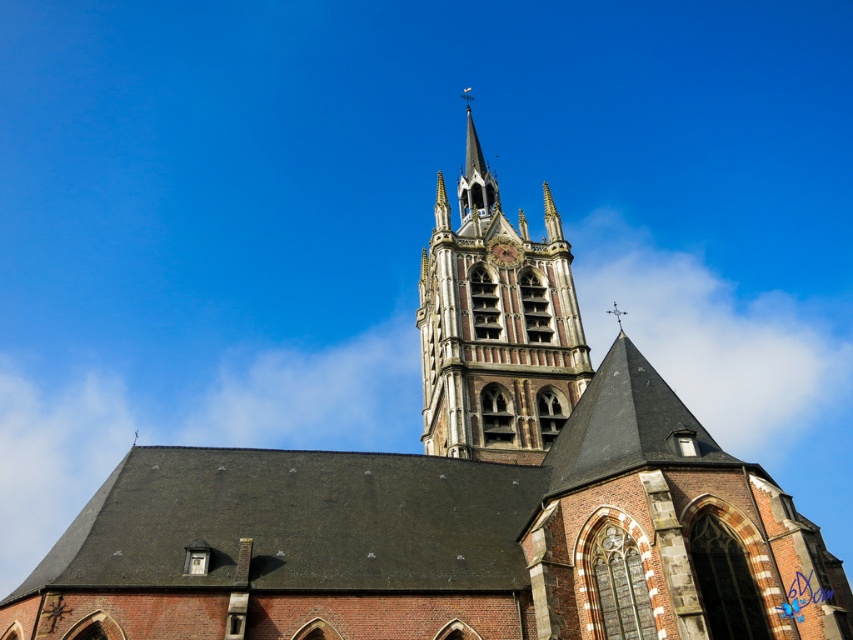
You are an architect assessing the church design. You notice the polished silver spire at upper center and the brass textured clock at upper center. Which of these two objects is taller?

The polished silver spire at upper center is taller than the brass textured clock at upper center.

You are standing in a field 100 feet away from the brown stone tower at center. Can you safely walk towards it without getting too close?

The brown stone tower at center is 188.72 feet away from you, so walking towards it from 100 feet away would bring you closer than the original distance, but since the question mentions being in a field, there might be enough space. However, the exact safe distance isn

You are an architect examining the church design. You need to determine if the brass textured clock at upper center can be placed horizontally on the brown stone tower at center without overlapping the edges. Can it fit?

The brown stone tower at center is wider than the brass textured clock at upper center, so yes, the clock can be placed horizontally on the tower without overlapping the edges since the tower has sufficient width.